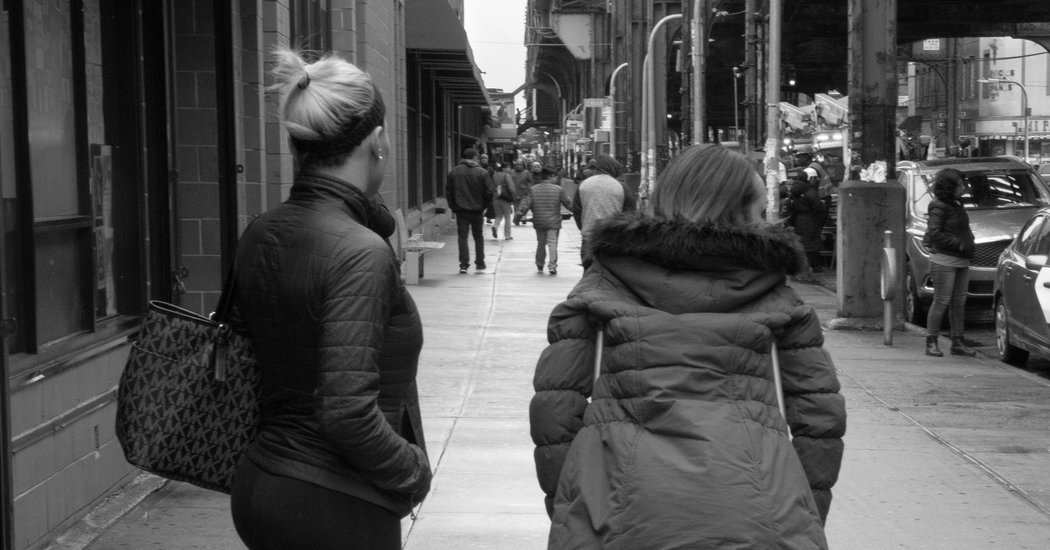
The width and height of the screenshot is (1050, 550). In order to click on bench in this screenshot , I will do `click(423, 243)`.